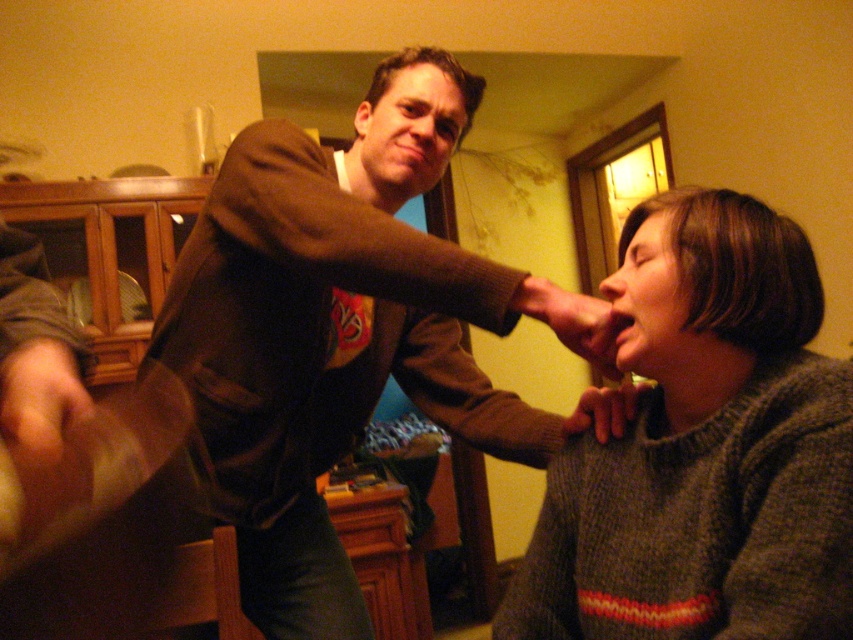
Is brown textured sweater at upper center taller than matte brown hand at upper center?

Yes.

In the scene shown: Is brown textured sweater at upper center positioned in front of matte brown hand at upper center?

Yes, it is in front of matte brown hand at upper center.

Is point (193, 332) more distant than point (598, 328)?

That is True.

The width and height of the screenshot is (853, 640). What are the coordinates of `brown textured sweater at upper center` in the screenshot? It's located at (334, 332).

Does matte brown hand at lower left have a smaller size compared to matte brown hand at lower right?

No.

Describe the element at coordinates (39, 397) in the screenshot. I see `matte brown hand at lower left` at that location.

The width and height of the screenshot is (853, 640). I want to click on matte brown hand at lower left, so click(39, 397).

Which is behind, point (584, 333) or point (584, 417)?

Positioned behind is point (584, 417).

Consider the image. Does matte brown hand at upper center have a greater height compared to matte brown hand at lower right?

Indeed, matte brown hand at upper center has a greater height compared to matte brown hand at lower right.

Who is more forward, [566,305] or [587,420]?

Point [566,305]

Where is `matte brown hand at upper center`? matte brown hand at upper center is located at coordinates (573, 321).